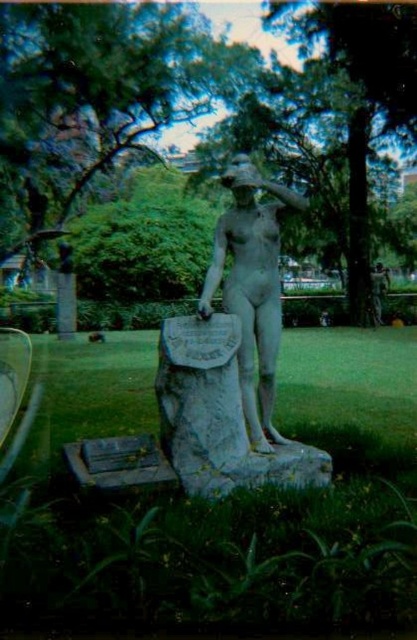
Question: Can you confirm if matte stone statue at center is wider than dark gray stone bench at center?

Choices:
 (A) no
 (B) yes

Answer: (B)

Question: Which point appears farthest from the camera in this image?

Choices:
 (A) (113, 449)
 (B) (246, 369)

Answer: (B)

Question: Is the position of matte stone statue at center more distant than that of dark gray stone bench at center?

Choices:
 (A) yes
 (B) no

Answer: (A)

Question: Is matte stone statue at center behind dark gray stone bench at center?

Choices:
 (A) yes
 (B) no

Answer: (A)